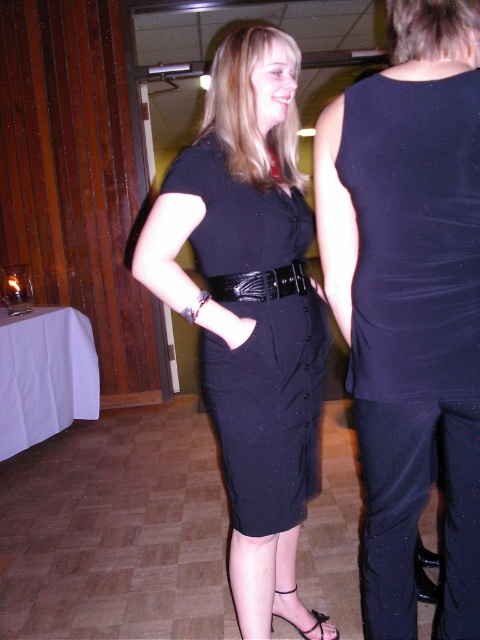
Question: Can you confirm if navy blue jersey dress at upper right is positioned to the right of black leather belt at center?

Choices:
 (A) no
 (B) yes

Answer: (B)

Question: Does black satin dress at center appear over black matte dress at center?

Choices:
 (A) yes
 (B) no

Answer: (A)

Question: Does black matte dress at center appear on the right side of black leather sandal at lower center?

Choices:
 (A) yes
 (B) no

Answer: (B)

Question: Which is nearer to the black leather belt at center?

Choices:
 (A) black satin dress at center
 (B) black leather sandal at lower center

Answer: (A)

Question: Which point is closer to the camera?

Choices:
 (A) black satin dress at center
 (B) black leather belt at center
 (C) navy blue jersey dress at upper right
 (D) black leather sandal at lower center

Answer: (C)

Question: Among these points, which one is farthest from the camera?

Choices:
 (A) (324, 275)
 (B) (278, 276)

Answer: (B)